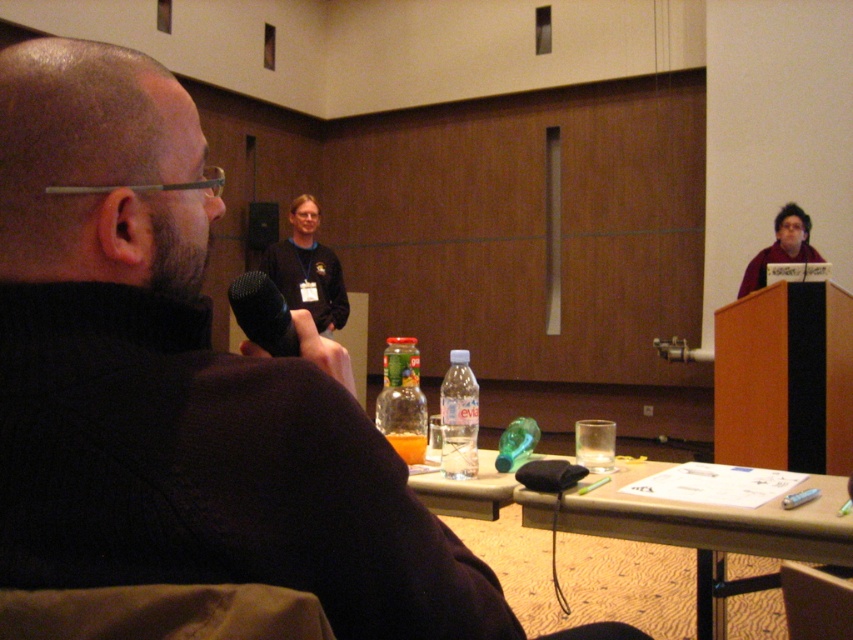
Is dark blue sweater at center smaller than matte purple sweater at upper right?

No, dark blue sweater at center is not smaller than matte purple sweater at upper right.

Between dark blue sweater at center and matte purple sweater at upper right, which one is positioned higher?

Positioned higher is matte purple sweater at upper right.

Which is in front, point (329, 317) or point (741, 294)?

Point (741, 294) is in front.

Find the location of a particular element. This screenshot has width=853, height=640. dark blue sweater at center is located at coordinates (306, 268).

Between wooden table at lower center and matte purple sweater at upper right, which one is positioned higher?

matte purple sweater at upper right is above.

Is wooden table at lower center smaller than matte purple sweater at upper right?

Actually, wooden table at lower center might be larger than matte purple sweater at upper right.

Between point (730, 525) and point (802, 212), which one is positioned in front?

Positioned in front is point (730, 525).

Find the location of a particular element. wooden table at lower center is located at coordinates (625, 545).

Is point (453, 451) closer to viewer compared to point (239, 317)?

No, it is behind (239, 317).

Is clear plastic bottle at center thinner than black matte microphone at center?

Yes, clear plastic bottle at center is thinner than black matte microphone at center.

Based on the photo, who is more forward, [453,428] or [288,352]?

Positioned in front is point [288,352].

Where is `clear plastic bottle at center`? This screenshot has height=640, width=853. clear plastic bottle at center is located at coordinates (457, 419).